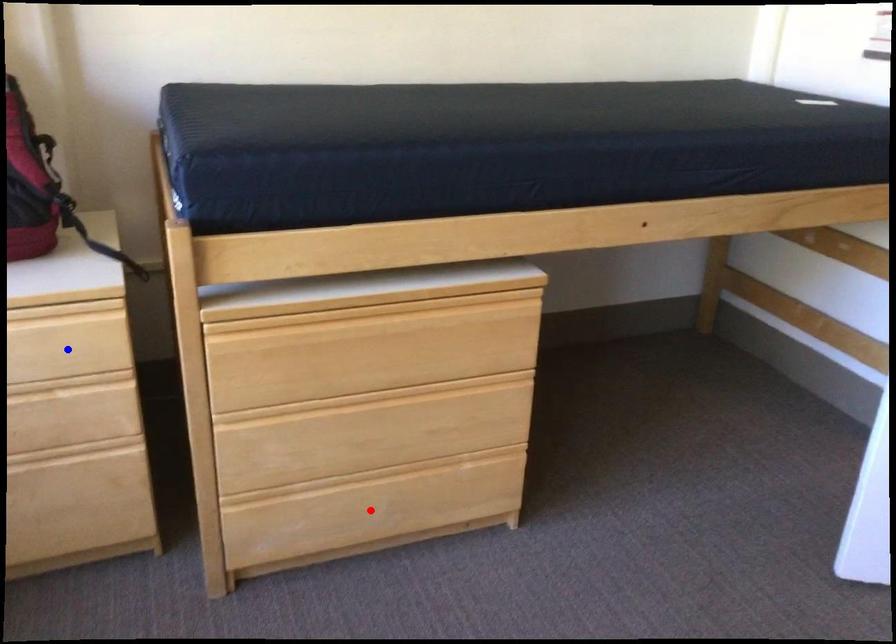
Question: Which of the two points in the image is closer to the camera?

Choices:
 (A) Blue point is closer.
 (B) Red point is closer.

Answer: (A)